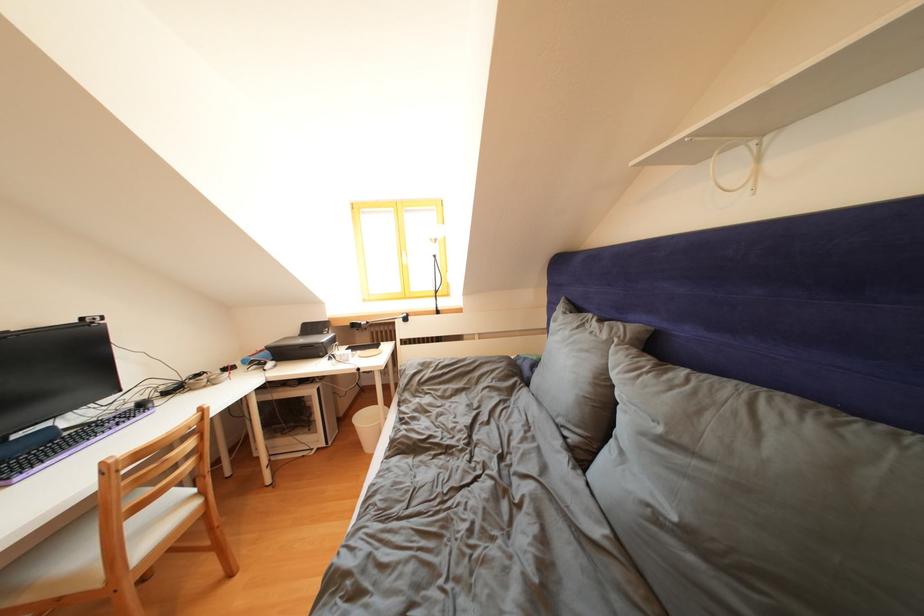
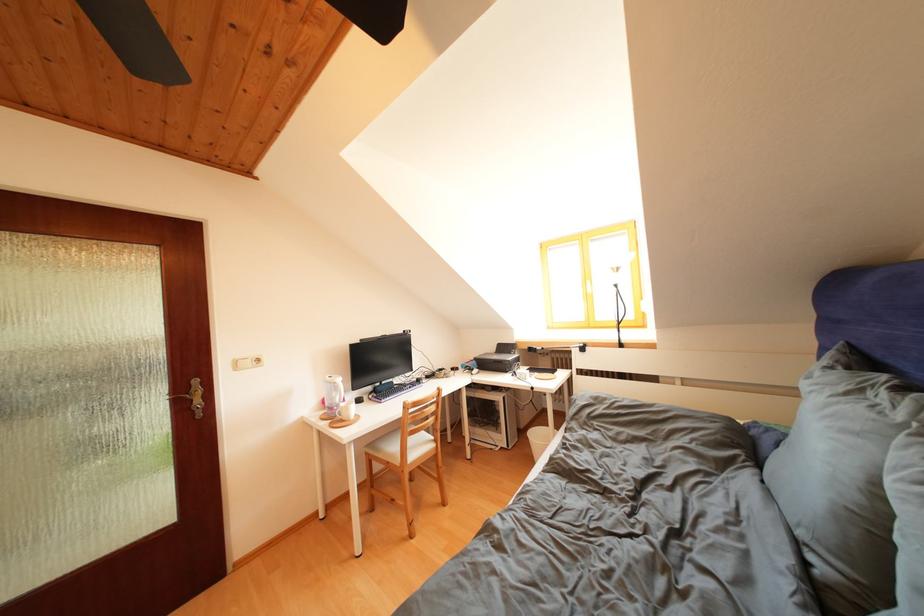
In the second image, find the point that corresponds to [371,424] in the first image.

(542, 439)